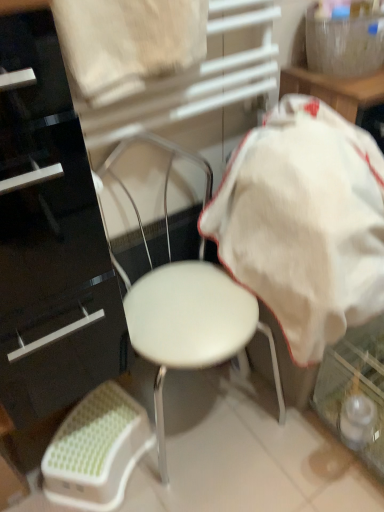
Identify the location of blank space situated above white plastic bar stool at lower left (from a real-world perspective). This screenshot has height=512, width=384. (93, 433).